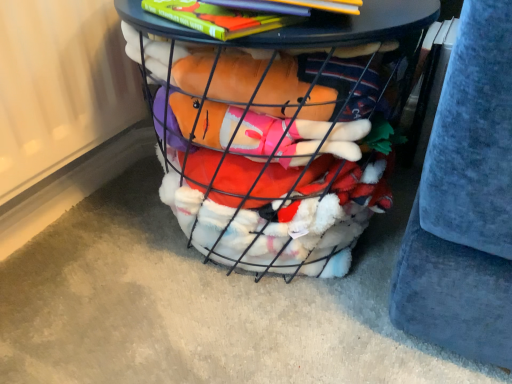
Question: Can you confirm if hardcover book at upper center is positioned to the right of wire mesh basket at center?

Choices:
 (A) yes
 (B) no

Answer: (A)

Question: Is hardcover book at upper center positioned beyond the bounds of wire mesh basket at center?

Choices:
 (A) yes
 (B) no

Answer: (A)

Question: Is hardcover book at upper center smaller than wire mesh basket at center?

Choices:
 (A) no
 (B) yes

Answer: (B)

Question: From the image's perspective, does hardcover book at upper center appear lower than wire mesh basket at center?

Choices:
 (A) no
 (B) yes

Answer: (A)

Question: Could you tell me if hardcover book at upper center is facing wire mesh basket at center?

Choices:
 (A) no
 (B) yes

Answer: (A)

Question: From a real-world perspective, is hardcover book at upper center physically located above or below wire mesh basket at center?

Choices:
 (A) above
 (B) below

Answer: (A)

Question: From their relative heights in the image, would you say hardcover book at upper center is taller or shorter than wire mesh basket at center?

Choices:
 (A) tall
 (B) short

Answer: (B)

Question: Is hardcover book at upper center to the left or to the right of wire mesh basket at center in the image?

Choices:
 (A) right
 (B) left

Answer: (A)

Question: Considering the positions of hardcover book at upper center and wire mesh basket at center in the image, is hardcover book at upper center wider or thinner than wire mesh basket at center?

Choices:
 (A) wide
 (B) thin

Answer: (B)

Question: From a real-world perspective, is velvety blue cushion at right above or below hardcover book at upper center?

Choices:
 (A) above
 (B) below

Answer: (B)

Question: Is velvety blue cushion at right spatially inside hardcover book at upper center, or outside of it?

Choices:
 (A) inside
 (B) outside

Answer: (B)

Question: Is velvety blue cushion at right wider or thinner than hardcover book at upper center?

Choices:
 (A) wide
 (B) thin

Answer: (A)

Question: Is velvety blue cushion at right taller or shorter than hardcover book at upper center?

Choices:
 (A) short
 (B) tall

Answer: (B)

Question: Which is correct: wire mesh basket at center is inside velvety blue cushion at right, or outside of it?

Choices:
 (A) outside
 (B) inside

Answer: (A)

Question: Considering their positions, is wire mesh basket at center located in front of or behind velvety blue cushion at right?

Choices:
 (A) behind
 (B) front

Answer: (A)